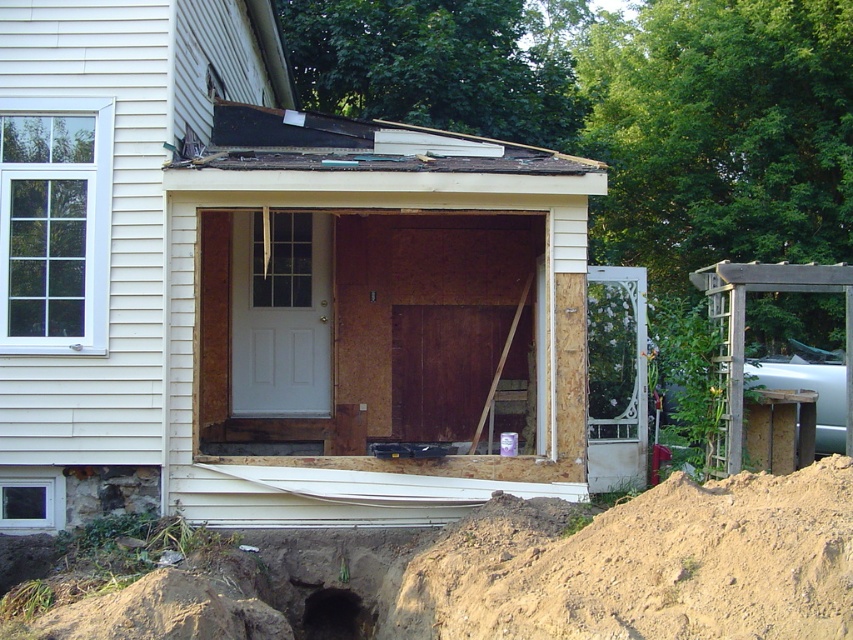
Identify the location of brown dirt mound at lower right. (645, 564).

Can you confirm if brown dirt mound at lower right is smaller than black dirt hole at lower center?

No.

Between point (837, 506) and point (357, 605), which one is positioned behind?

The point (357, 605) is more distant.

This screenshot has height=640, width=853. Identify the location of brown dirt mound at lower right. (645, 564).